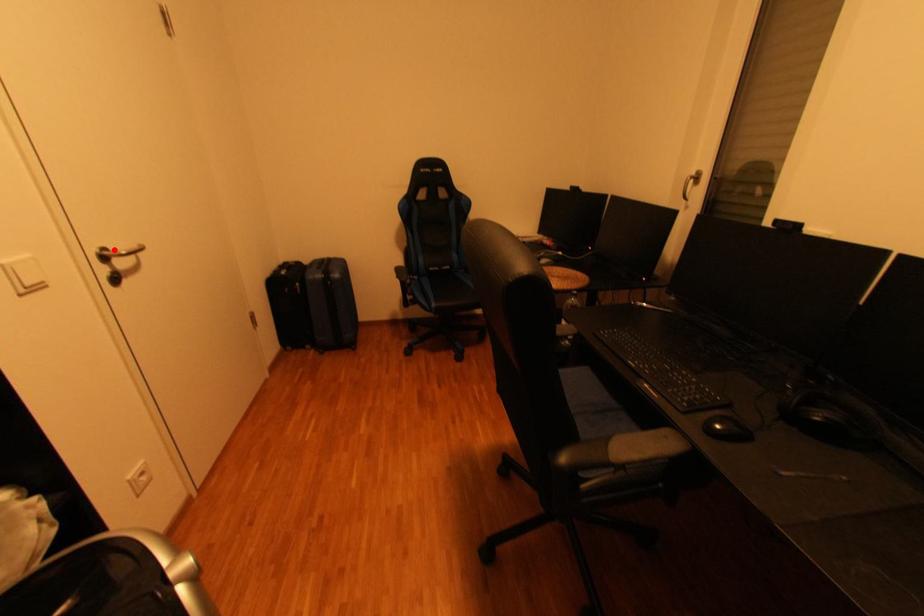
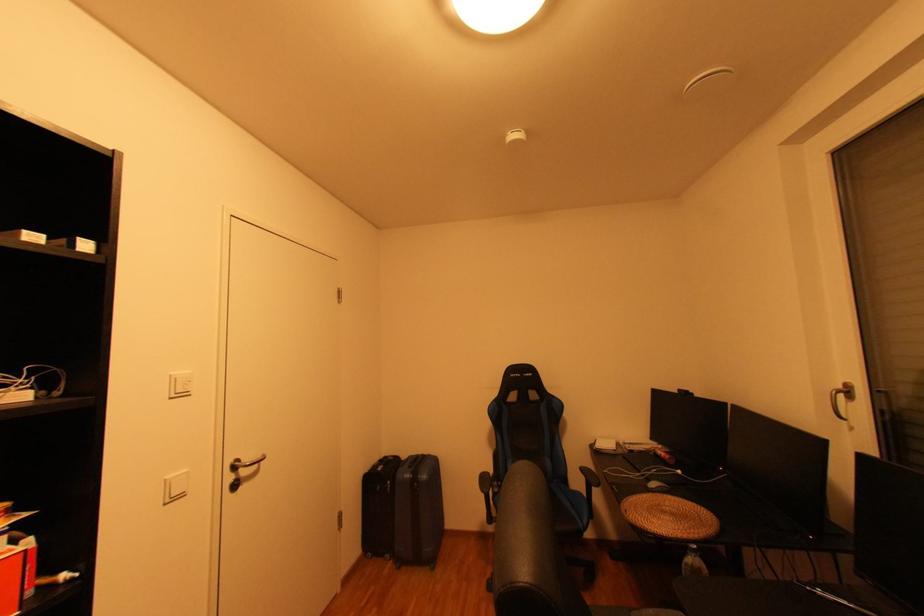
Where in the second image is the point corresponding to the highlighted location from the first image?

(247, 461)